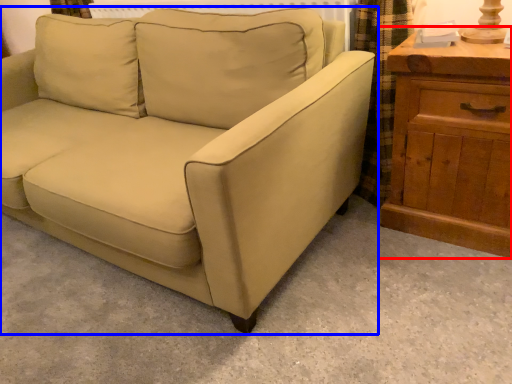
Question: Which object is further to the camera taking this photo, chest of drawers (highlighted by a red box) or studio couch (highlighted by a blue box)?

Choices:
 (A) chest of drawers
 (B) studio couch

Answer: (A)